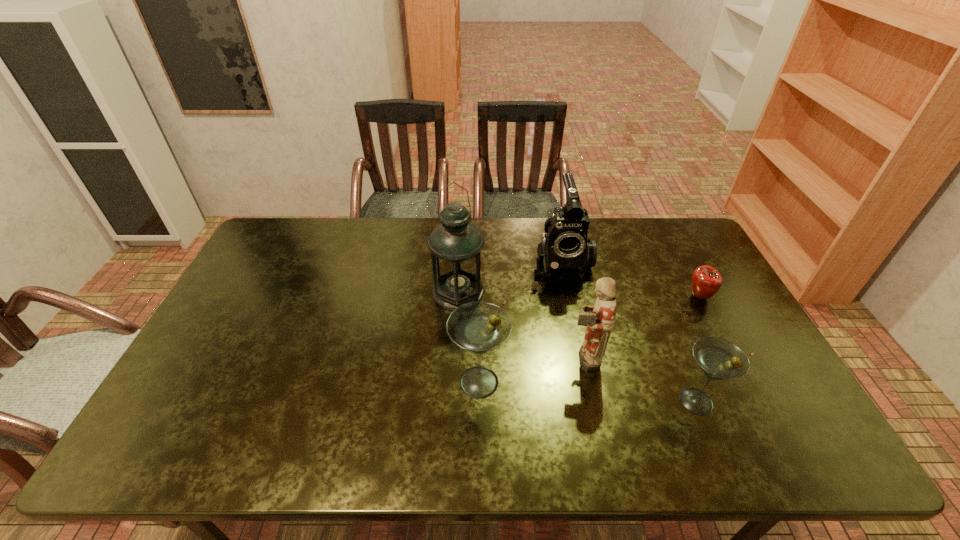
Considering the uniform spacing of martinis, where should an additional martini be positioned on the left? Please locate a free spot. Please provide its 2D coordinates. Your answer should be formatted as a tuple, i.e. [(x, y)], where the tuple contains the x and y coordinates of a point satisfying the conditions above.

[(277, 364)]